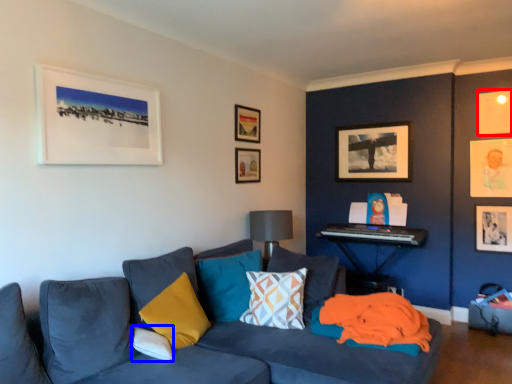
Question: Which of the following is the closest to the observer, picture frame (highlighted by a red box) or pillow (highlighted by a blue box)?

Choices:
 (A) picture frame
 (B) pillow

Answer: (B)